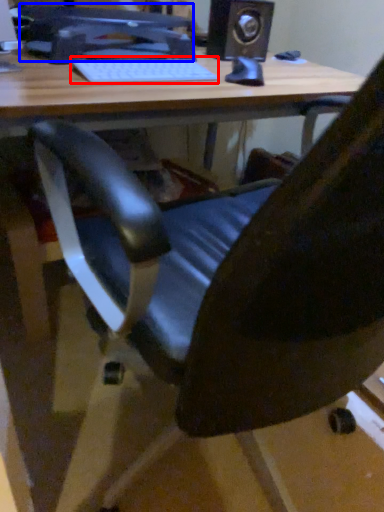
Question: Which point is closer to the camera, laptop keyboard (highlighted by a red box) or computer monitor (highlighted by a blue box)?

Choices:
 (A) laptop keyboard
 (B) computer monitor

Answer: (A)